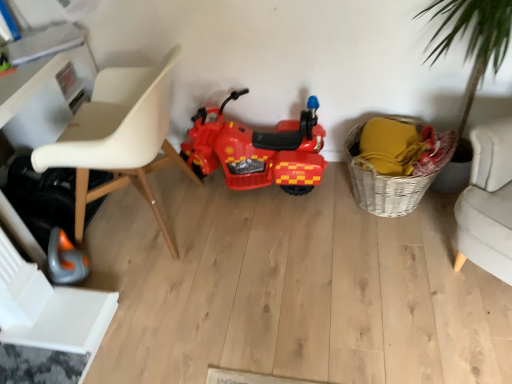
Question: Is shiny plastic motorcycle at center wider or thinner than woven basket at lower right?

Choices:
 (A) thin
 (B) wide

Answer: (A)

Question: Is shiny plastic motorcycle at center spatially inside woven basket at lower right, or outside of it?

Choices:
 (A) outside
 (B) inside

Answer: (A)

Question: Based on their relative distances, which object is farther from the white plastic swivel chair at lower left?

Choices:
 (A) shiny plastic motorcycle at center
 (B) woven basket at lower right
 (C) white plastic chair at left

Answer: (B)

Question: Which is nearer to the white plastic chair at left?

Choices:
 (A) woven basket at lower right
 (B) shiny plastic motorcycle at center
 (C) white plastic swivel chair at lower left

Answer: (B)